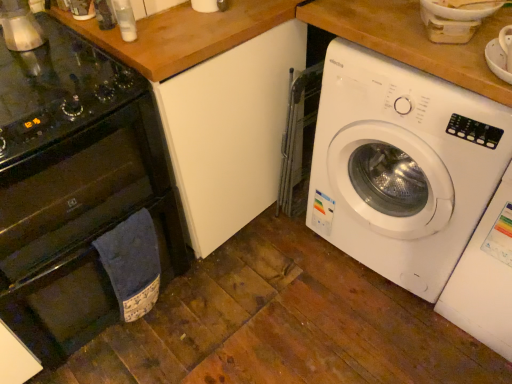
Question: Are white plastic washing machine at right, the 1th washing machine viewed from the left, and metallic silver kettle at upper left beside each other?

Choices:
 (A) yes
 (B) no

Answer: (B)

Question: Is metallic silver kettle at upper left surrounded by white plastic washing machine at right, the 2th washing machine from the right?

Choices:
 (A) no
 (B) yes

Answer: (A)

Question: Is white plastic washing machine at right, the 2th washing machine from the right, further to camera compared to metallic silver kettle at upper left?

Choices:
 (A) no
 (B) yes

Answer: (A)

Question: From a real-world perspective, is white plastic washing machine at right, the 1th washing machine viewed from the left, below metallic silver kettle at upper left?

Choices:
 (A) no
 (B) yes

Answer: (B)

Question: Does white plastic washing machine at right, the 1th washing machine viewed from the left, have a smaller size compared to metallic silver kettle at upper left?

Choices:
 (A) no
 (B) yes

Answer: (A)

Question: In the image, is white plastic washing machine at right, the 2th washing machine from the right, positioned in front of or behind metallic silver kettle at upper left?

Choices:
 (A) behind
 (B) front

Answer: (B)

Question: Visually, is white plastic washing machine at right, the 1th washing machine viewed from the left, positioned to the left or to the right of metallic silver kettle at upper left?

Choices:
 (A) right
 (B) left

Answer: (A)

Question: From the image's perspective, relative to metallic silver kettle at upper left, is white plastic washing machine at right, the 1th washing machine viewed from the left, above or below?

Choices:
 (A) above
 (B) below

Answer: (B)

Question: Is white plastic washing machine at right, the 1th washing machine viewed from the left, situated inside metallic silver kettle at upper left or outside?

Choices:
 (A) outside
 (B) inside

Answer: (A)

Question: Considering their positions, is black glass oven at left located in front of or behind black glass gas stove at left?

Choices:
 (A) front
 (B) behind

Answer: (A)

Question: From the image's perspective, relative to black glass gas stove at left, is black glass oven at left above or below?

Choices:
 (A) above
 (B) below

Answer: (B)

Question: In terms of height, does black glass oven at left look taller or shorter compared to black glass gas stove at left?

Choices:
 (A) tall
 (B) short

Answer: (A)

Question: From a real-world perspective, is black glass oven at left positioned above or below black glass gas stove at left?

Choices:
 (A) below
 (B) above

Answer: (A)

Question: Is white plastic washing machine at right, the 1th washing machine viewed from the left, taller or shorter than black glass gas stove at left?

Choices:
 (A) tall
 (B) short

Answer: (A)

Question: Is white plastic washing machine at right, the 1th washing machine viewed from the left, inside or outside of black glass gas stove at left?

Choices:
 (A) inside
 (B) outside

Answer: (B)